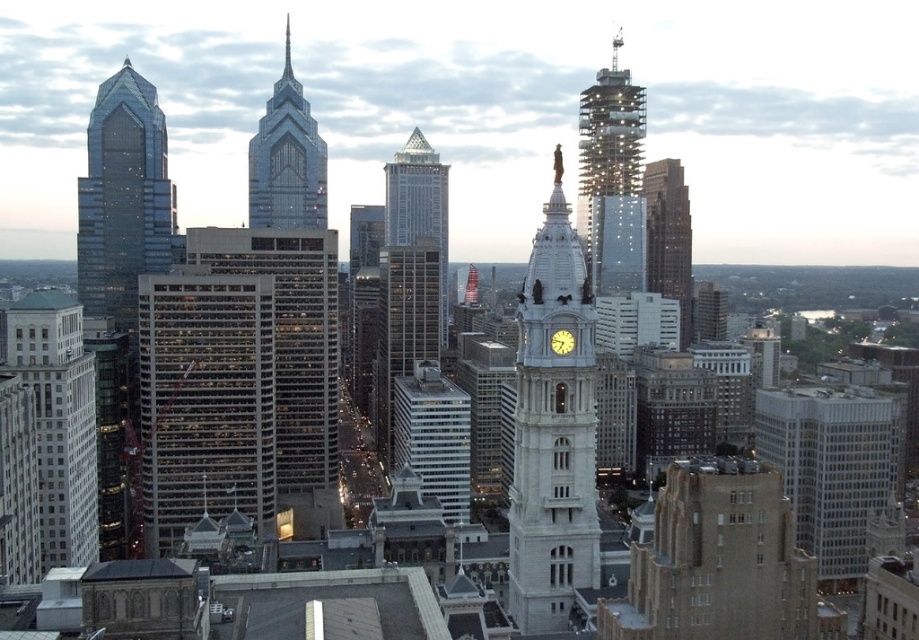
Question: Observing the image, what is the correct spatial positioning of shiny glass spire at upper center in reference to metallic spire at upper right?

Choices:
 (A) below
 (B) above

Answer: (A)

Question: Estimate the real-world distances between objects in this image. Which object is farther from the gray glass skyscraper at center?

Choices:
 (A) glassy steel skyscraper at center
 (B) yellow matte clock at center
 (C) white stone clock tower at center

Answer: (B)

Question: Does glassy steel skyscraper at center have a larger size compared to yellow matte clock at center?

Choices:
 (A) no
 (B) yes

Answer: (B)

Question: Among these points, which one is farthest from the camera?

Choices:
 (A) (556, 362)
 (B) (89, 417)

Answer: (B)

Question: Among these objects, which one is nearest to the camera?

Choices:
 (A) white marble building at left
 (B) gray glass skyscraper at center
 (C) glassy steel skyscraper at center
 (D) silver glass skyscraper at center

Answer: (A)

Question: Does white marble building at left appear on the left side of gray glass skyscraper at center?

Choices:
 (A) yes
 (B) no

Answer: (A)